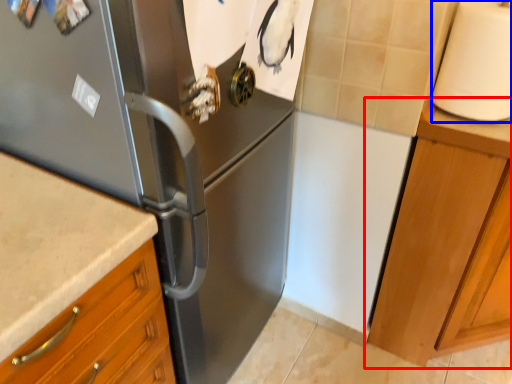
Question: Which object appears farthest to the camera in this image, cabinetry (highlighted by a red box) or paper towel (highlighted by a blue box)?

Choices:
 (A) cabinetry
 (B) paper towel

Answer: (A)